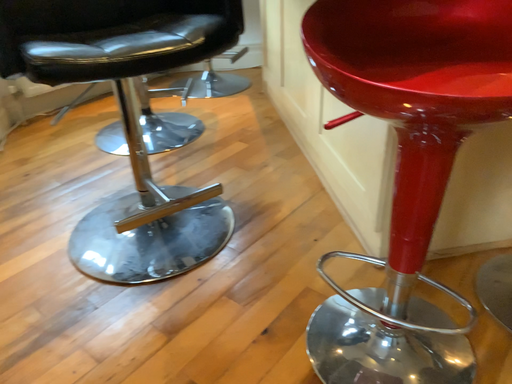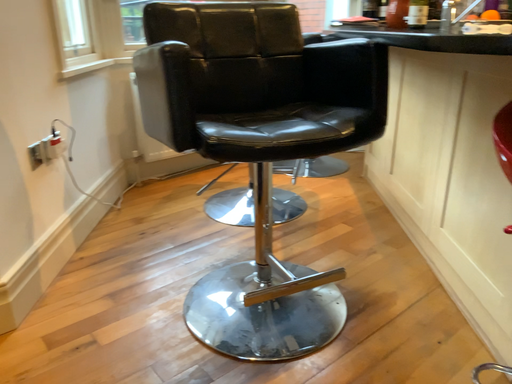
Question: Which way did the camera rotate in the video?

Choices:
 (A) rotated left
 (B) rotated right

Answer: (A)